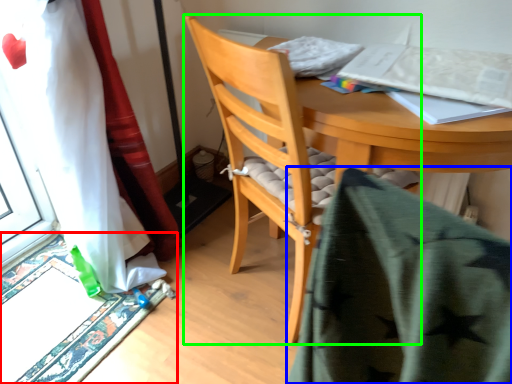
Question: Estimate the real-world distances between objects in this image. Which object is closer to doormat (highlighted by a red box), blanket (highlighted by a blue box) or chair (highlighted by a green box)?

Choices:
 (A) blanket
 (B) chair

Answer: (B)